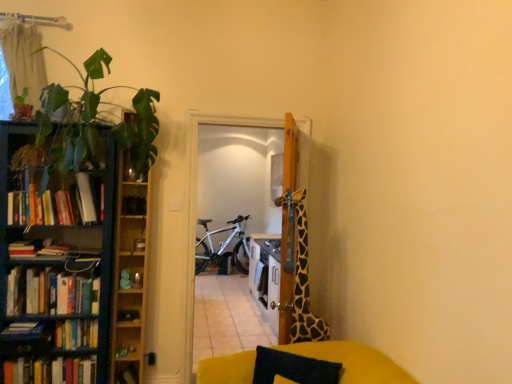
Question: From a real-world perspective, does black fabric pillow at lower center sit lower than wooden cabinet at left?

Choices:
 (A) yes
 (B) no

Answer: (A)

Question: Is black fabric pillow at lower center looking in the opposite direction of wooden cabinet at left?

Choices:
 (A) yes
 (B) no

Answer: (B)

Question: Does black fabric pillow at lower center appear on the right side of wooden cabinet at left?

Choices:
 (A) yes
 (B) no

Answer: (A)

Question: From the image's perspective, is black fabric pillow at lower center located beneath wooden cabinet at left?

Choices:
 (A) yes
 (B) no

Answer: (A)

Question: Does black fabric pillow at lower center touch wooden cabinet at left?

Choices:
 (A) yes
 (B) no

Answer: (B)

Question: Is black fabric pillow at lower center wider or thinner than green leafy plant at left?

Choices:
 (A) wide
 (B) thin

Answer: (B)

Question: From their relative heights in the image, would you say black fabric pillow at lower center is taller or shorter than green leafy plant at left?

Choices:
 (A) short
 (B) tall

Answer: (A)

Question: From the image's perspective, is black fabric pillow at lower center positioned above or below green leafy plant at left?

Choices:
 (A) below
 (B) above

Answer: (A)

Question: From a real-world perspective, is black fabric pillow at lower center physically located above or below green leafy plant at left?

Choices:
 (A) above
 (B) below

Answer: (B)

Question: In terms of size, does hardcover books at left, which appears as the sixth book when ordered from the bottom, appear bigger or smaller than green matte bookcase at left?

Choices:
 (A) small
 (B) big

Answer: (A)

Question: Is hardcover books at left, which appears as the sixth book when ordered from the bottom, wider or thinner than green matte bookcase at left?

Choices:
 (A) thin
 (B) wide

Answer: (A)

Question: From their relative heights in the image, would you say hardcover books at left, arranged as the 1th book when viewed from the top, is taller or shorter than green matte bookcase at left?

Choices:
 (A) tall
 (B) short

Answer: (B)

Question: Visually, is hardcover books at left, arranged as the 1th book when viewed from the top, positioned to the left or to the right of green matte bookcase at left?

Choices:
 (A) left
 (B) right

Answer: (B)

Question: Considering the relative positions of white sheer curtain at upper left and black fabric pillow at lower center in the image provided, is white sheer curtain at upper left to the left or to the right of black fabric pillow at lower center?

Choices:
 (A) left
 (B) right

Answer: (A)

Question: Looking at their shapes, would you say white sheer curtain at upper left is wider or thinner than black fabric pillow at lower center?

Choices:
 (A) thin
 (B) wide

Answer: (A)